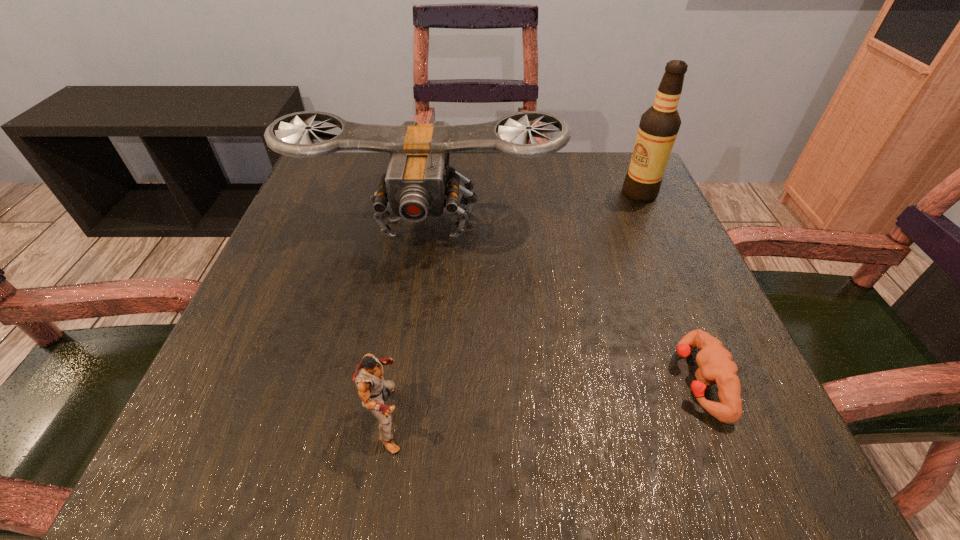
At what (x,y) coordinates should I click in order to perform the action: click on the tallest object. Please return your answer as a coordinate pair (x, y). Looking at the image, I should click on (659, 125).

Where is `drone`? This screenshot has height=540, width=960. drone is located at coordinates (419, 183).

I want to click on the taller puncher, so click(372, 389).

This screenshot has width=960, height=540. In order to click on the left puncher in this screenshot , I will do `click(372, 389)`.

Where is `the shortest object`? Image resolution: width=960 pixels, height=540 pixels. the shortest object is located at coordinates 716,366.

Where is `the shorter puncher`? the shorter puncher is located at coordinates (716, 366).

You are a GUI agent. You are given a task and a screenshot of the screen. Output one action in this format:
    pyautogui.click(x=<x>, y=<y>)
    Task: Click on the free location located on the label of the alcohol
    
    Given the screenshot: What is the action you would take?
    pyautogui.click(x=577, y=193)

Where is `vacant space located 0.330m on the label of the alcohol`? The image size is (960, 540). vacant space located 0.330m on the label of the alcohol is located at coordinates (475, 193).

What are the coordinates of `free space located 0.320m on the label of the alcohol` in the screenshot? It's located at (480, 193).

The image size is (960, 540). What are the coordinates of `free point located on the front-facing side of the drone` in the screenshot? It's located at (411, 336).